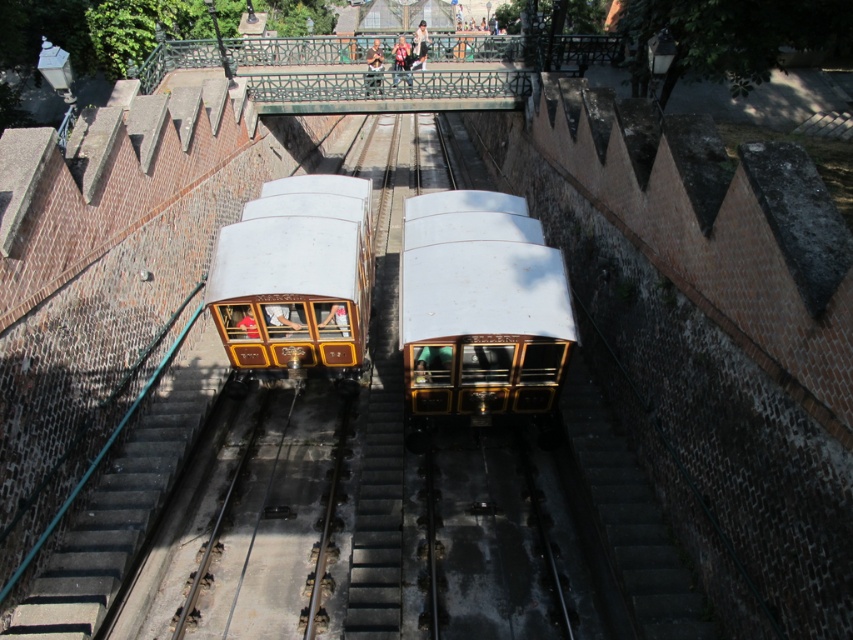
Question: Which point is closer to the camera taking this photo?

Choices:
 (A) (289, 362)
 (B) (492, 374)

Answer: (B)

Question: Which point is closer to the camera?

Choices:
 (A) (235, 228)
 (B) (445, 214)

Answer: (A)

Question: Does white polished wood train at center come in front of gold polished wood train at center?

Choices:
 (A) no
 (B) yes

Answer: (B)

Question: Can you confirm if white polished wood train at center is positioned above gold polished wood train at center?

Choices:
 (A) yes
 (B) no

Answer: (B)

Question: Is white polished wood train at center to the right of gold polished wood train at center from the viewer's perspective?

Choices:
 (A) no
 (B) yes

Answer: (B)